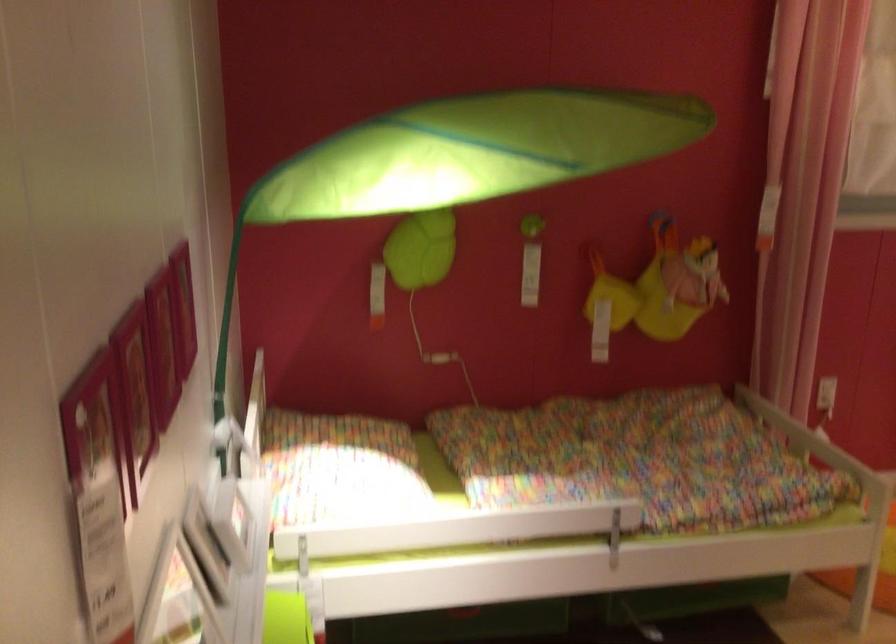
Where would you pull the blue strap handle? Please return your answer as a coordinate pair (x, y).

(226, 339)